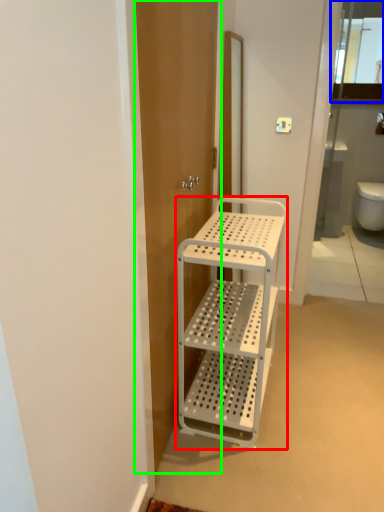
Question: Which object is the closest to the furniture (highlighted by a red box)? Choose among these: cabinet (highlighted by a blue box) or screen door (highlighted by a green box).

Choices:
 (A) cabinet
 (B) screen door

Answer: (B)